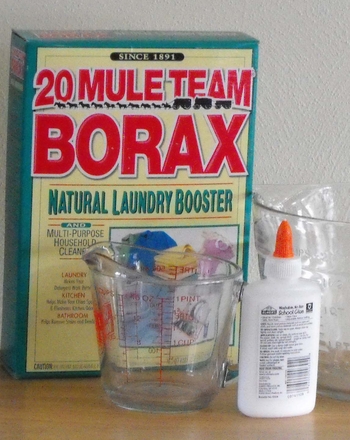
Locate an element on the screen. This screenshot has width=350, height=440. box is located at coordinates (88, 42).